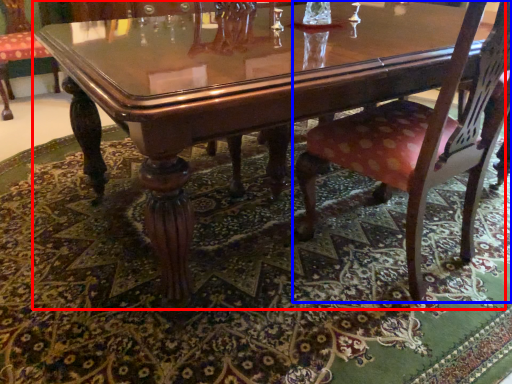
Question: Among these objects, which one is nearest to the camera, coffee table (highlighted by a red box) or chair (highlighted by a blue box)?

Choices:
 (A) coffee table
 (B) chair

Answer: (A)